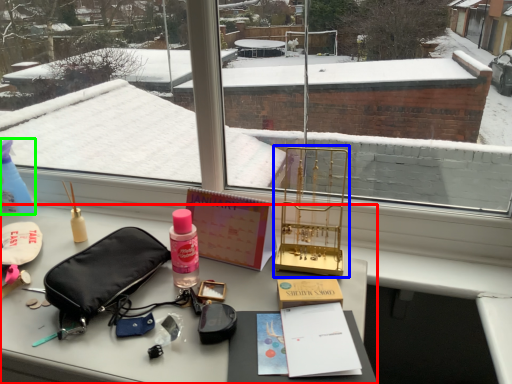
Question: Which is nearer to the desk (highlighted by a red box)? bird cage (highlighted by a blue box) or bottle (highlighted by a green box).

Choices:
 (A) bird cage
 (B) bottle

Answer: (A)